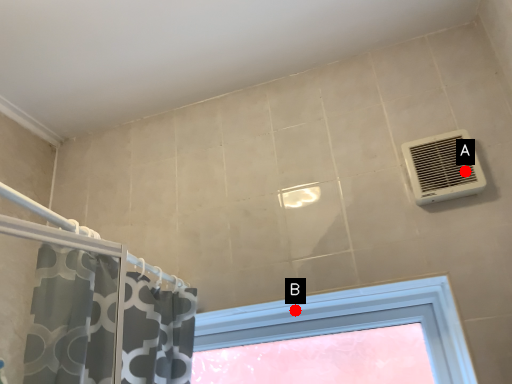
Question: Two points are circled on the image, labeled by A and B beside each circle. Which point appears farthest from the camera in this image?

Choices:
 (A) A is further
 (B) B is further

Answer: (B)